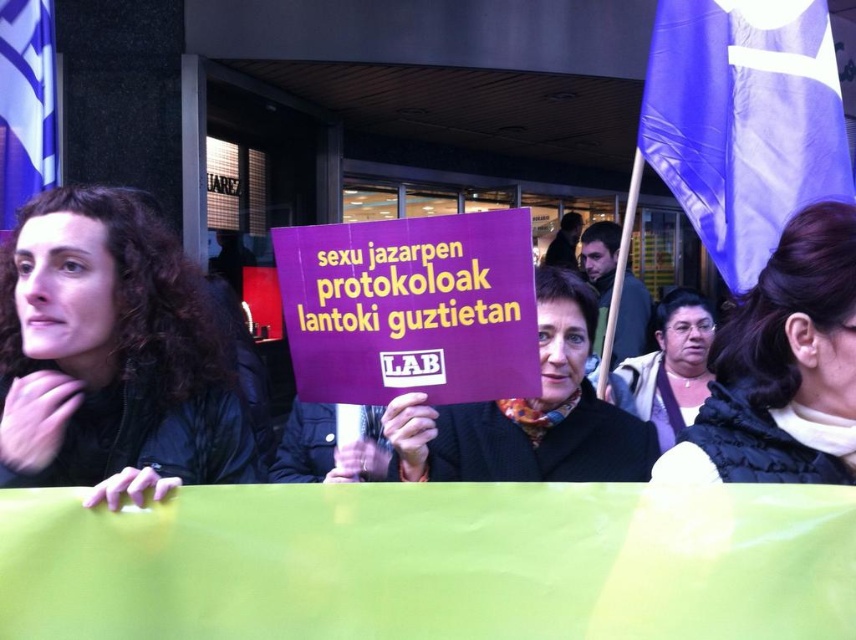
Question: Which object is closer to the camera taking this photo?

Choices:
 (A) matte black scarf at center
 (B) purple fabric flag at upper right
 (C) blue fabric flag at upper left

Answer: (B)

Question: Is dark curly hair at left in front of purple fabric flag at upper right?

Choices:
 (A) no
 (B) yes

Answer: (B)

Question: Does purple fabric flag at upper right lie behind matte black scarf at center?

Choices:
 (A) yes
 (B) no

Answer: (B)

Question: Is dark curly hair at left positioned before purple fabric flag at upper right?

Choices:
 (A) yes
 (B) no

Answer: (A)

Question: Which object is positioned farthest from the matte black scarf at center?

Choices:
 (A) dark curly hair at left
 (B) purple fabric flag at upper right
 (C) purple matte sign at center

Answer: (A)

Question: Which of the following is the closest to the observer?

Choices:
 (A) purple matte sign at center
 (B) black fabric hair at upper right

Answer: (B)